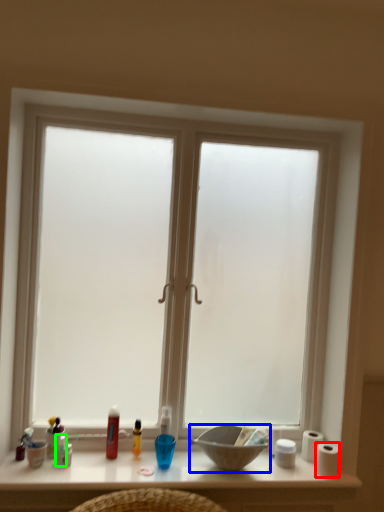
Question: Which object is positioned closest to toilet paper (highlighted by a red box)? Select from bowl (highlighted by a blue box) and toiletry (highlighted by a green box).

Choices:
 (A) bowl
 (B) toiletry

Answer: (A)